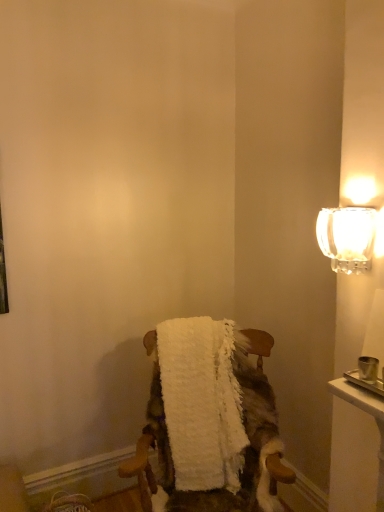
Question: Based on their sizes in the image, would you say white fluffy bath towel at center is bigger or smaller than white fluffy blanket at center?

Choices:
 (A) small
 (B) big

Answer: (A)

Question: Is white fluffy bath towel at center in front of or behind white fluffy blanket at center in the image?

Choices:
 (A) front
 (B) behind

Answer: (B)

Question: Based on their relative distances, which object is nearer to the white fluffy blanket at center?

Choices:
 (A) clear glass sconce at upper right
 (B) white fluffy bath towel at center

Answer: (B)

Question: Which is nearer to the white fluffy blanket at center?

Choices:
 (A) clear glass sconce at upper right
 (B) white fluffy bath towel at center

Answer: (B)